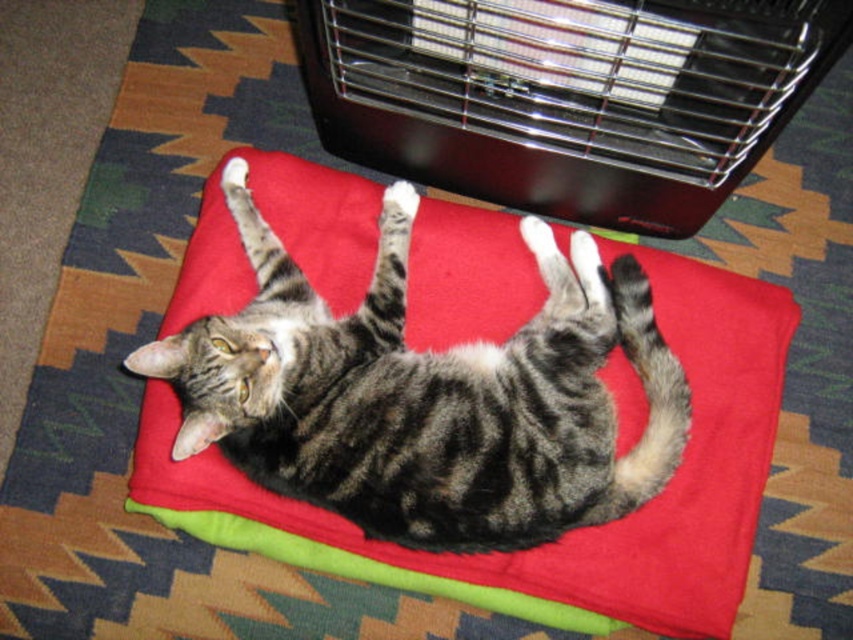
Question: Does tabby fur cat at center appear on the right side of black metal heater at upper center?

Choices:
 (A) yes
 (B) no

Answer: (B)

Question: Is tabby fur cat at center smaller than black metal heater at upper center?

Choices:
 (A) no
 (B) yes

Answer: (B)

Question: Is tabby fur cat at center above black metal heater at upper center?

Choices:
 (A) no
 (B) yes

Answer: (A)

Question: Which point is farther to the camera?

Choices:
 (A) black metal heater at upper center
 (B) tabby fur cat at center

Answer: (B)